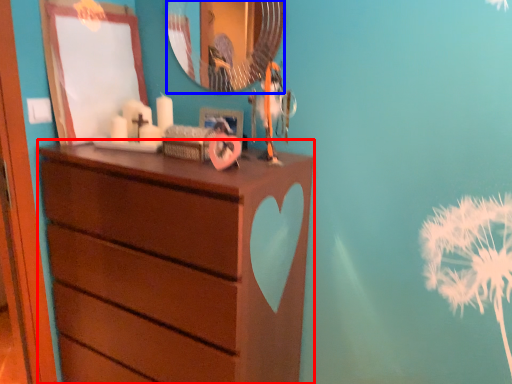
Question: Which of the following is the closest to the observer, chest of drawers (highlighted by a red box) or mirror (highlighted by a blue box)?

Choices:
 (A) chest of drawers
 (B) mirror

Answer: (A)